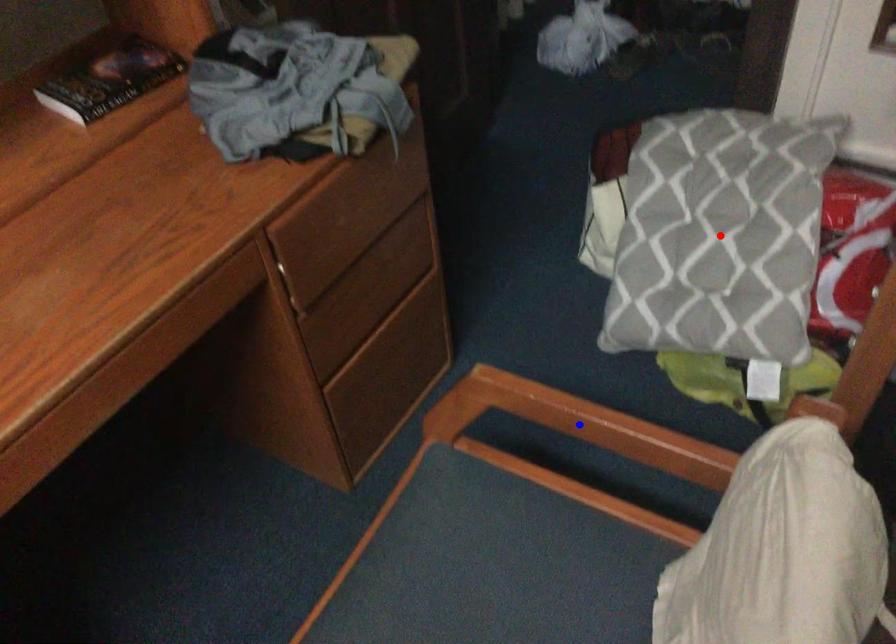
Question: Which of the two points in the image is closer to the camera?

Choices:
 (A) Blue point is closer.
 (B) Red point is closer.

Answer: (A)